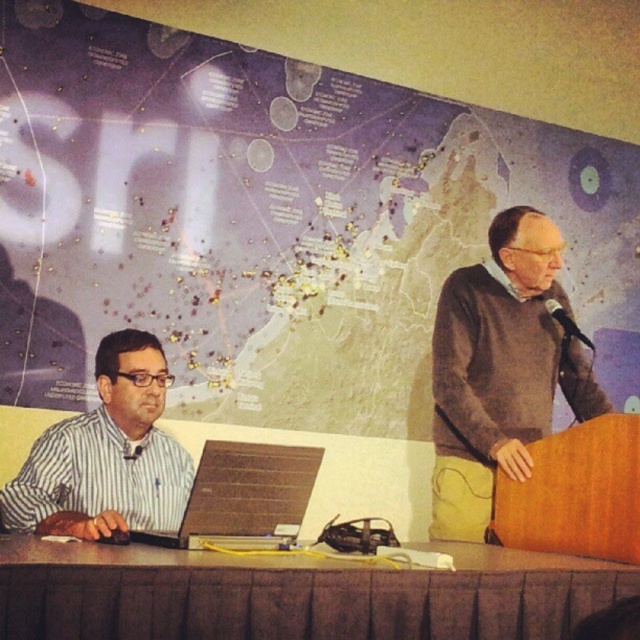
Question: Does dark gray sweater at right appear on the right side of matte black laptop at left?

Choices:
 (A) yes
 (B) no

Answer: (A)

Question: Does brown fabric table at lower center appear on the left side of matte black laptop at left?

Choices:
 (A) yes
 (B) no

Answer: (B)

Question: Which of the following is the closest to the observer?

Choices:
 (A) click(563, 308)
 (B) click(138, 426)
 (C) click(252, 540)

Answer: (C)

Question: Which point is farther to the camera?

Choices:
 (A) (148, 396)
 (B) (221, 445)
 (C) (577, 333)

Answer: (C)

Question: Which object is the farthest from the matte black laptop at left?

Choices:
 (A) dark gray sweater at right
 (B) striped fabric shirt at left
 (C) brown fabric table at lower center
 (D) black plastic microphone at upper right

Answer: (D)

Question: Is striped fabric shirt at left to the left of matte black laptop at left from the viewer's perspective?

Choices:
 (A) no
 (B) yes

Answer: (B)